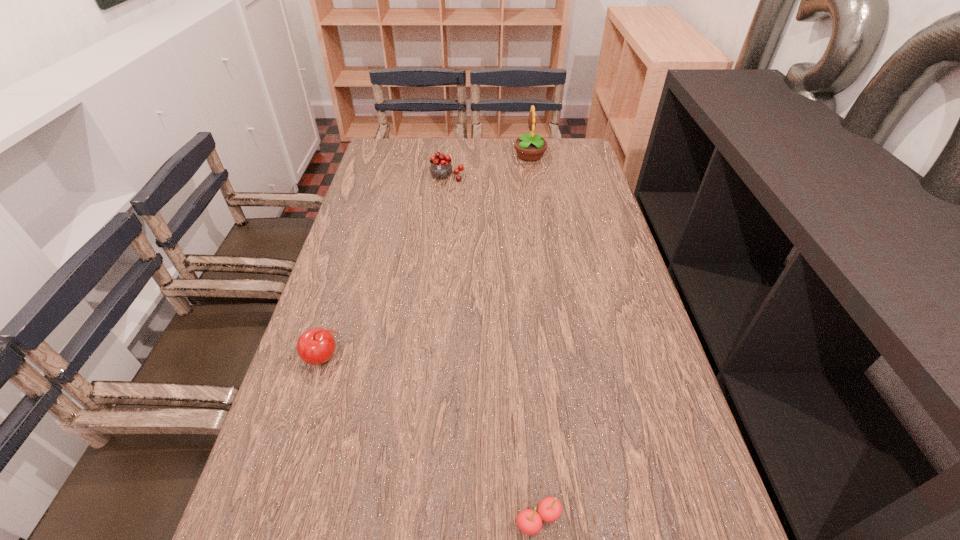
The width and height of the screenshot is (960, 540). What are the coordinates of `empty location between the shortest object and the third object from right to left` in the screenshot? It's located at (492, 348).

Locate an element on the screen. Image resolution: width=960 pixels, height=540 pixels. free space between the nearest object and the leftmost object is located at coordinates (432, 439).

Image resolution: width=960 pixels, height=540 pixels. What are the coordinates of `empty space that is in between the rightmost cherry and the third nearest object` in the screenshot? It's located at (492, 348).

Locate an element on the screen. The width and height of the screenshot is (960, 540). the second closest object to the second farthest object is located at coordinates (316, 346).

The image size is (960, 540). Identify the location of object that is the third nearest to the second tallest cherry. (x=530, y=147).

The width and height of the screenshot is (960, 540). What are the coordinates of `the closest cherry to the rightmost cherry` in the screenshot? It's located at coord(316,346).

Identify which cherry is the second closest to the leftmost cherry. Please provide its 2D coordinates. Your answer should be formatted as a tuple, i.e. [(x, y)], where the tuple contains the x and y coordinates of a point satisfying the conditions above.

[(440, 168)]

You are a GUI agent. You are given a task and a screenshot of the screen. Output one action in this format:
    pyautogui.click(x=<x>, y=<y>)
    Task: Click on the vacant area that satisfies the following two spatial constraints: 1. on the face of the farthest object; 2. on the handle side of the farthest cherry
    The image size is (960, 540).
    Given the screenshot: What is the action you would take?
    pyautogui.click(x=533, y=177)

In order to click on free point that satisfies the following two spatial constraints: 1. on the face of the farthest object; 2. on the handle side of the second object from left to right in this screenshot , I will do `click(533, 177)`.

Where is `blank space that satisfies the following two spatial constraints: 1. on the handle side of the second farthest object; 2. on the right side of the nearest cherry`? The image size is (960, 540). blank space that satisfies the following two spatial constraints: 1. on the handle side of the second farthest object; 2. on the right side of the nearest cherry is located at coordinates (412, 519).